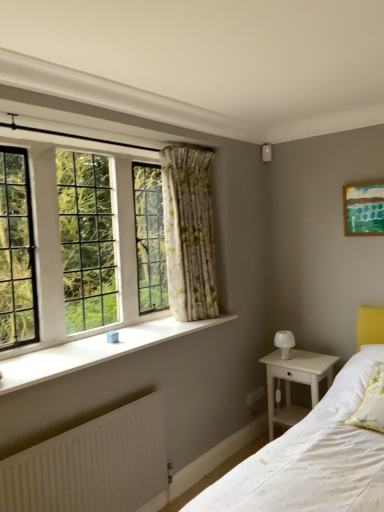
At what (x,y) coordinates should I click in order to perform the action: click on empty space that is ontop of floral fabric curtain at center (from a real-world perspective). Please return your answer as a coordinate pair (x, y). This screenshot has height=512, width=384. Looking at the image, I should click on (190, 145).